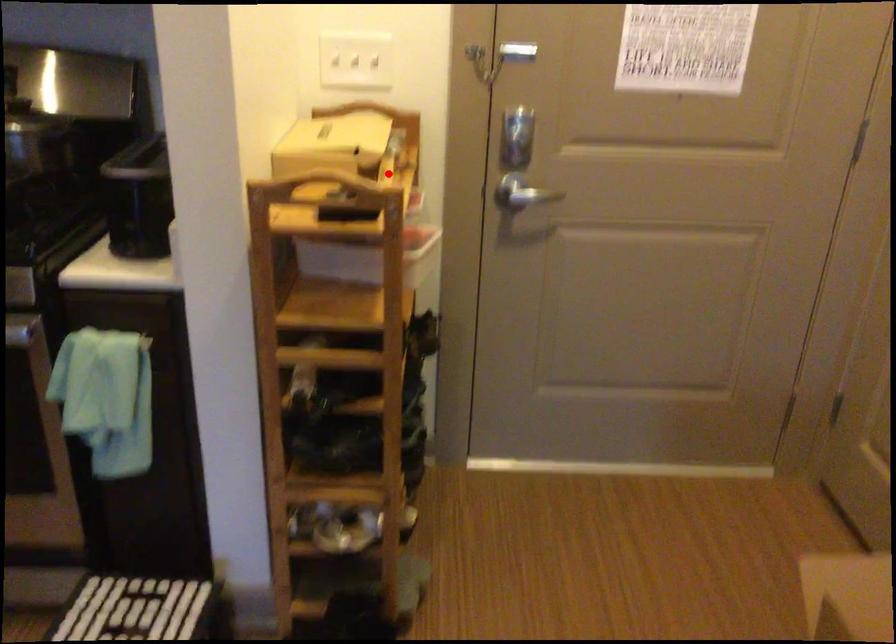
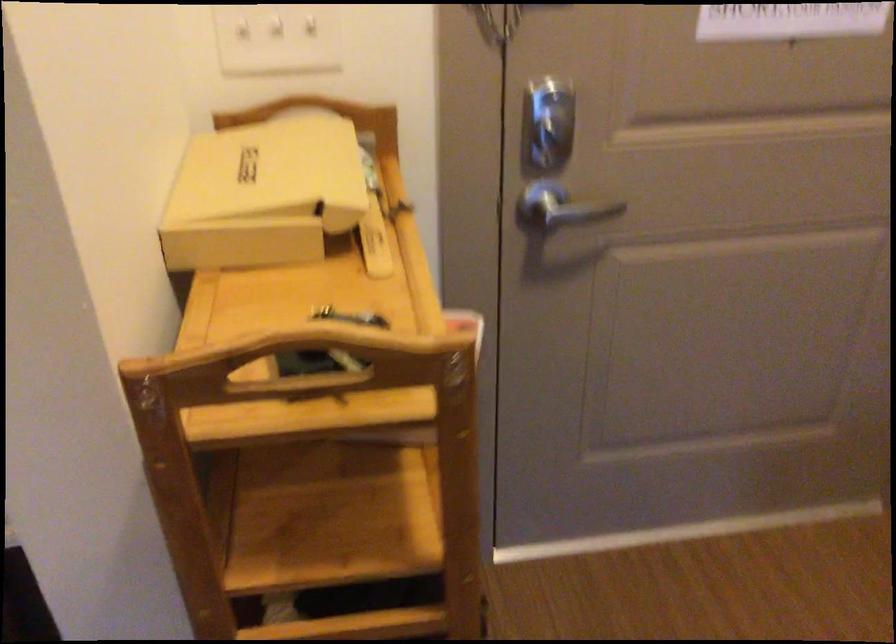
Question: I am providing you with two images of the same scene from different viewpoints. A red point is shown in image1. For the corresponding object point in image2, is it positioned nearer or farther from the camera?

Choices:
 (A) Nearer
 (B) Farther

Answer: (A)